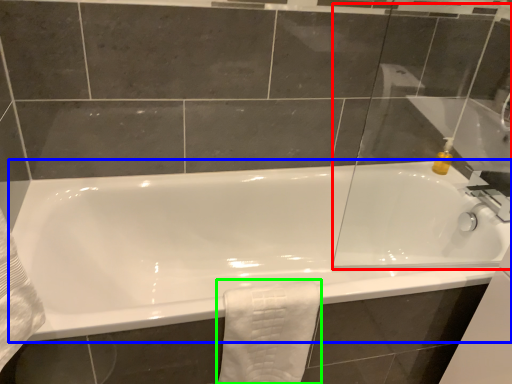
Question: Based on their relative distances, which object is farther from glass door (highlighted by a red box)? Choose from bathtub (highlighted by a blue box) and bath towel (highlighted by a green box).

Choices:
 (A) bathtub
 (B) bath towel

Answer: (B)